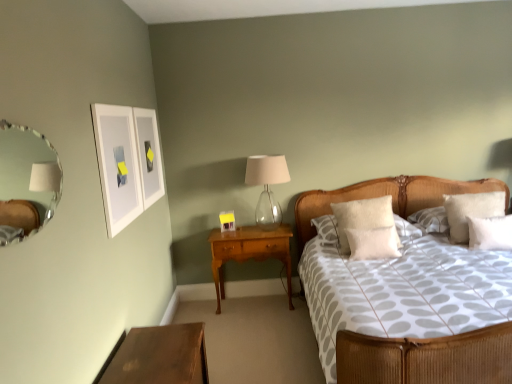
The width and height of the screenshot is (512, 384). I want to click on blank area beneath clear glass table lamp at center (from a real-world perspective), so click(267, 228).